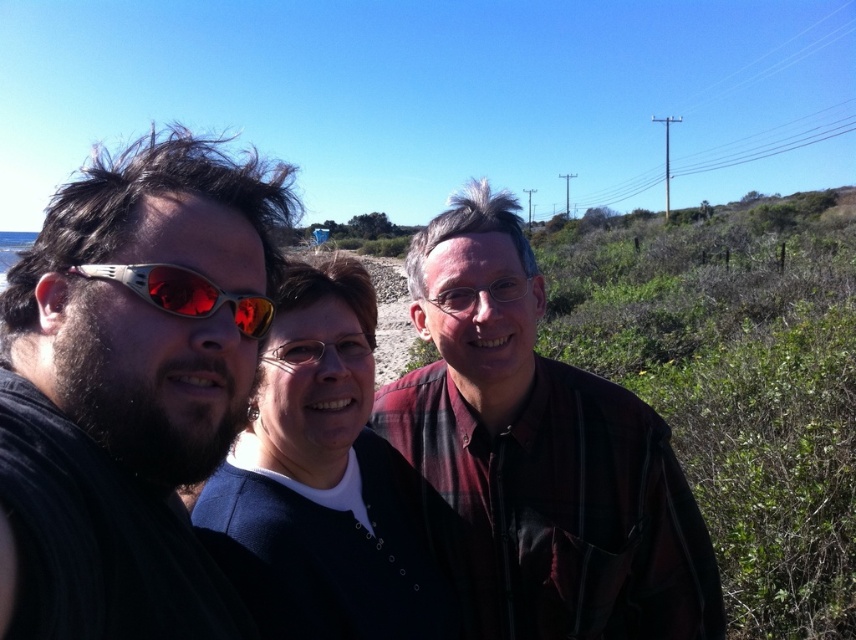
Question: Is matte black shirt at left further to camera compared to plaid shirt at center?

Choices:
 (A) yes
 (B) no

Answer: (B)

Question: Does black fabric at center have a greater width compared to matte plastic goggles at left?

Choices:
 (A) no
 (B) yes

Answer: (B)

Question: Which point is farther from the camera taking this photo?

Choices:
 (A) (387, 470)
 (B) (438, 328)

Answer: (A)

Question: Can you confirm if black fabric at center is bigger than matte black shirt at left?

Choices:
 (A) no
 (B) yes

Answer: (B)

Question: Based on their relative distances, which object is nearer to the dark blue sweater at center?

Choices:
 (A) black fabric at center
 (B) matte black shirt at left
 (C) plaid shirt at center
 (D) matte plastic goggles at left

Answer: (A)

Question: Considering the real-world distances, which object is farthest from the plaid shirt at center?

Choices:
 (A) black fabric at center
 (B) matte black shirt at left

Answer: (B)